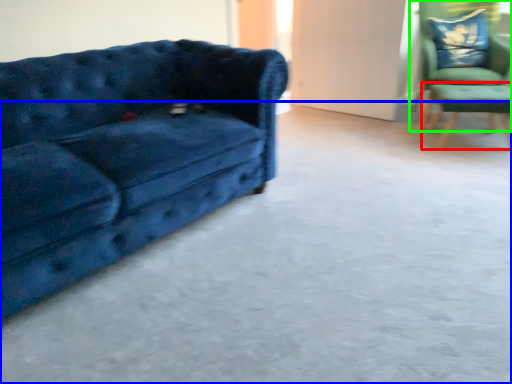
Question: Estimate the real-world distances between objects in this image. Which object is farther from side table (highlighted by a red box), concrete (highlighted by a blue box) or chair (highlighted by a green box)?

Choices:
 (A) concrete
 (B) chair

Answer: (A)